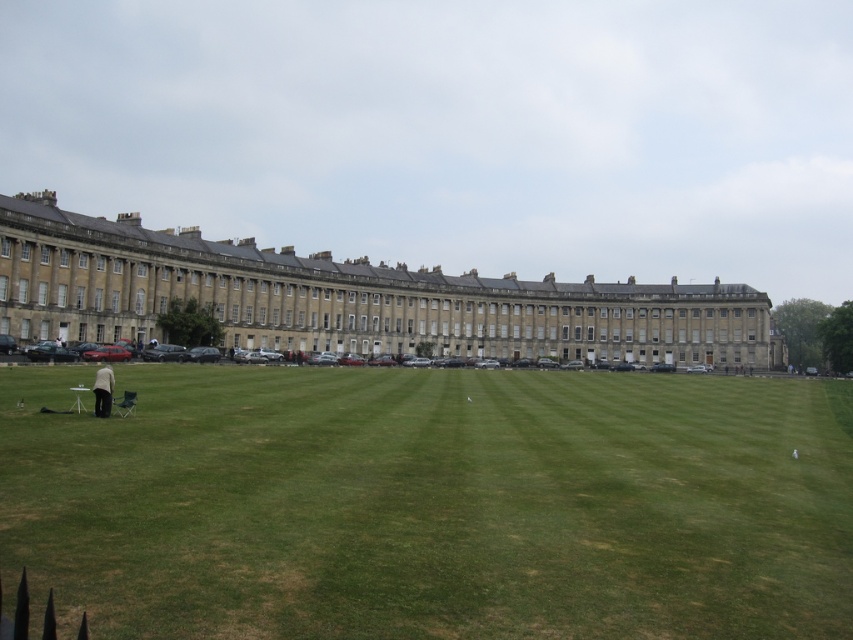
You are standing in the open area and want to take a photo of the beige stone palace at center. To ensure the palace is in focus, should you adjust your camera to focus on the green grass at center or the palace itself?

The beige stone palace at center is further away from the viewer than the green grass at center. Therefore, to focus on the palace, adjust the camera to focus on the palace itself rather than the green grass at center.

You are a photographer planning to take a full body portrait of the light beige fabric jacket at lower left. You want to include the beige stone palace at center in the background to show its grandeur. Is the palace tall enough to be captured in the background while focusing on the jacket?

The beige stone palace at center is much taller than the light beige fabric jacket at lower left, so yes, the palace will be prominently visible in the background of the portrait.

You are standing in the open grassy area in front of the beige stone palace at center. You see a light beige fabric jacket at lower left. Which object is larger?

The beige stone palace at center is bigger than the light beige fabric jacket at lower left.